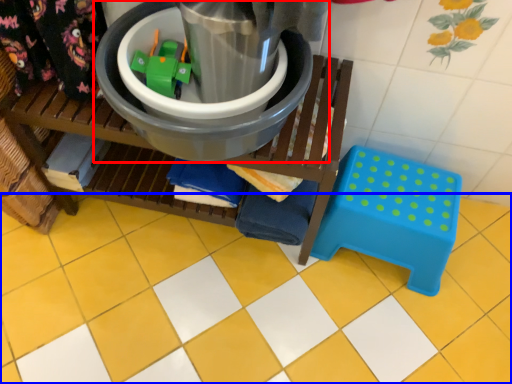
Question: Which point is closer to the camera, appliance (highlighted by a red box) or ceramic tile (highlighted by a blue box)?

Choices:
 (A) appliance
 (B) ceramic tile

Answer: (A)